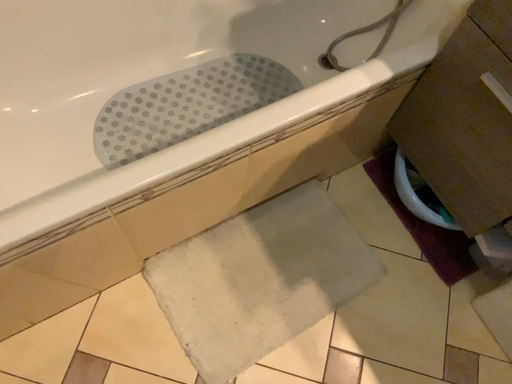
Question: Should I look upward or downward to see beige matte tile at lower right?

Choices:
 (A) down
 (B) up

Answer: (A)

Question: Can you confirm if beige matte tile at lower right is bigger than white rubber mat at upper center?

Choices:
 (A) no
 (B) yes

Answer: (A)

Question: Is the position of beige matte tile at lower right less distant than that of white rubber mat at upper center?

Choices:
 (A) no
 (B) yes

Answer: (A)

Question: Is beige matte tile at lower right wider than white rubber mat at upper center?

Choices:
 (A) yes
 (B) no

Answer: (B)

Question: Is beige matte tile at lower right positioned with its back to white rubber mat at upper center?

Choices:
 (A) yes
 (B) no

Answer: (B)

Question: Can you confirm if beige matte tile at lower right is smaller than white rubber mat at upper center?

Choices:
 (A) yes
 (B) no

Answer: (A)

Question: From the image's perspective, is beige matte tile at lower right over white rubber mat at upper center?

Choices:
 (A) yes
 (B) no

Answer: (B)

Question: Can you confirm if beige matte tile at lower right is bigger than white soft bath mat at lower center, positioned as the 2th bath mat in right-to-left order?

Choices:
 (A) yes
 (B) no

Answer: (B)

Question: From the image's perspective, is beige matte tile at lower right located above white soft bath mat at lower center, positioned as the 2th bath mat in right-to-left order?

Choices:
 (A) no
 (B) yes

Answer: (A)

Question: Does beige matte tile at lower right appear on the left side of white soft bath mat at lower center, which ranks as the first bath mat in left-to-right order?

Choices:
 (A) yes
 (B) no

Answer: (B)

Question: Would you say beige matte tile at lower right is outside white soft bath mat at lower center, positioned as the 2th bath mat in right-to-left order?

Choices:
 (A) yes
 (B) no

Answer: (A)

Question: Is beige matte tile at lower right oriented away from white soft bath mat at lower center, positioned as the 2th bath mat in right-to-left order?

Choices:
 (A) yes
 (B) no

Answer: (B)

Question: From the image's perspective, is beige matte tile at lower right beneath white soft bath mat at lower center, positioned as the 2th bath mat in right-to-left order?

Choices:
 (A) no
 (B) yes

Answer: (B)

Question: From the image's perspective, is white glossy toilet bowl at lower right beneath purple fabric bath mat at lower right, positioned as the first bath mat in right-to-left order?

Choices:
 (A) no
 (B) yes

Answer: (A)